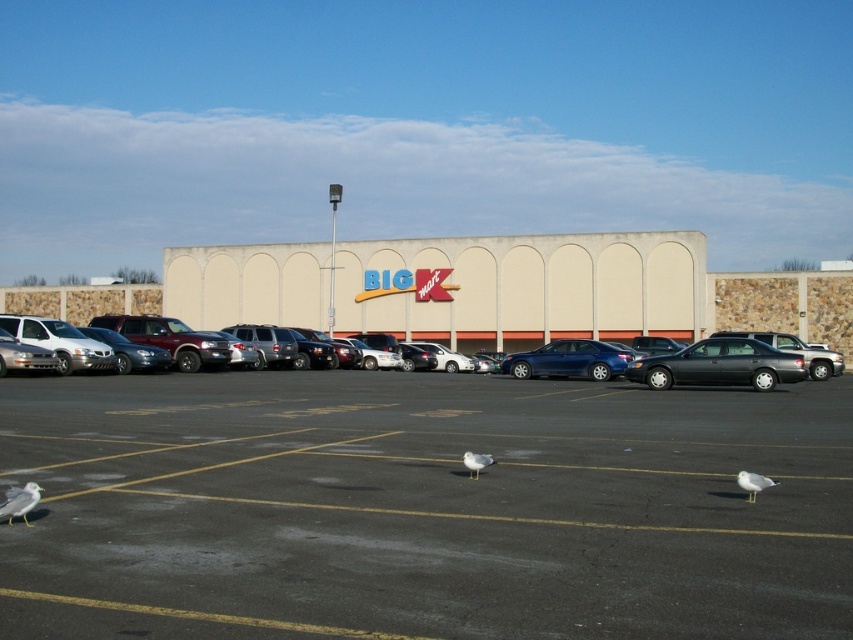
Question: Which object is the closest to the matte blue sedan at center?

Choices:
 (A) white matte bird at lower left
 (B) shiny black sedan at center
 (C) black asphalt parking lot at center
 (D) white feathered bird at lower right

Answer: (B)

Question: Among these objects, which one is nearest to the camera?

Choices:
 (A) white feathered bird at center
 (B) shiny black sedan at center
 (C) black asphalt parking lot at center
 (D) metallic silver sedan at center

Answer: (C)

Question: From the image, what is the correct spatial relationship of black asphalt parking lot at center in relation to white feathered bird at lower right?

Choices:
 (A) right
 (B) left

Answer: (B)

Question: Which object appears closest to the camera in this image?

Choices:
 (A) white feathered bird at center
 (B) shiny black sedan at center
 (C) white matte bird at lower left
 (D) metallic silver sedan at center

Answer: (C)

Question: Can you confirm if white matte bird at lower left is bigger than white feathered bird at lower right?

Choices:
 (A) yes
 (B) no

Answer: (A)

Question: Is shiny black sedan at center above white matte bird at lower left?

Choices:
 (A) no
 (B) yes

Answer: (B)